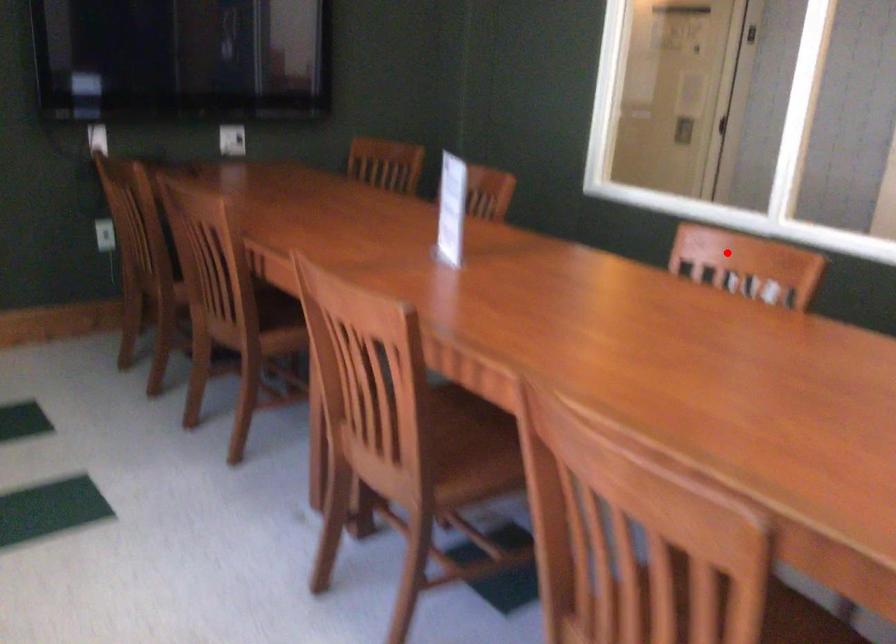
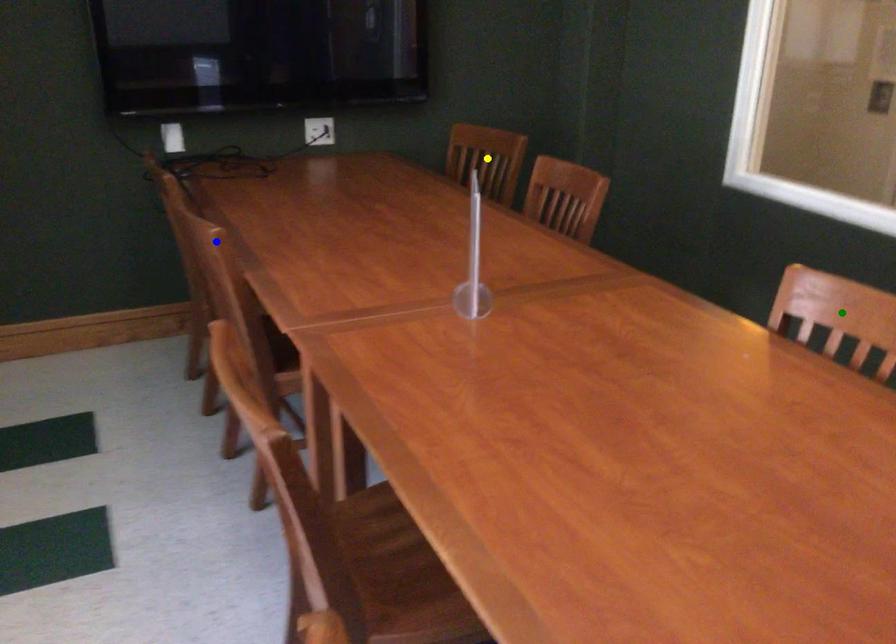
Question: I am providing you with two images of the same scene from different viewpoints. A red point is marked on the first image. You are given multiple points on the second image. Which spot in image 2 lines up with the point in image 1?

Choices:
 (A) green point
 (B) yellow point
 (C) blue point

Answer: (A)